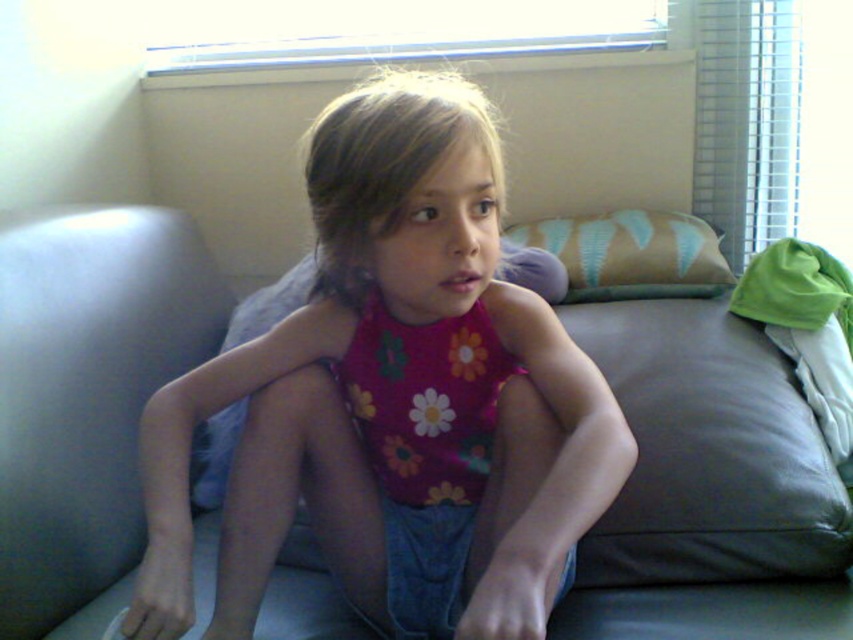
Question: Among these objects, which one is nearest to the camera?

Choices:
 (A) floral tank top at center
 (B) beige fabric pillow at upper right

Answer: (A)

Question: Which point appears farthest from the camera in this image?

Choices:
 (A) (252, 483)
 (B) (718, 284)

Answer: (B)

Question: Is floral tank top at center behind beige fabric pillow at upper right?

Choices:
 (A) yes
 (B) no

Answer: (B)

Question: Which point appears closest to the camera in this image?

Choices:
 (A) tap(544, 241)
 (B) tap(403, 269)

Answer: (B)

Question: Is floral tank top at center to the right of beige fabric pillow at upper right from the viewer's perspective?

Choices:
 (A) yes
 (B) no

Answer: (B)

Question: Is floral tank top at center wider than beige fabric pillow at upper right?

Choices:
 (A) yes
 (B) no

Answer: (A)